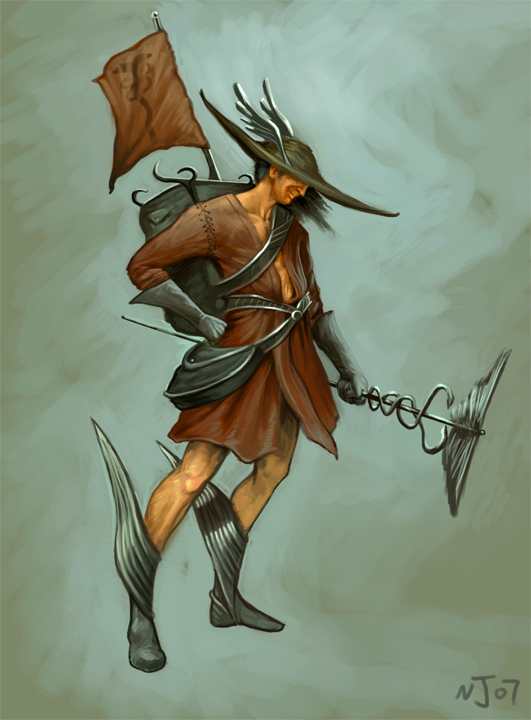
Where is `robe`? The image size is (531, 720). robe is located at coordinates (242, 242), (294, 366).